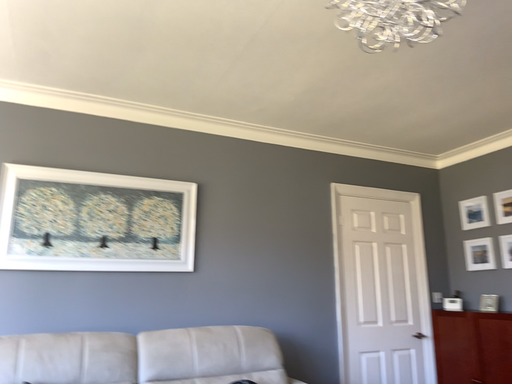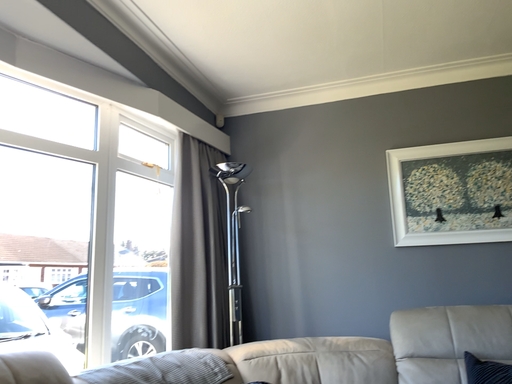
Question: Which way did the camera rotate in the video?

Choices:
 (A) rotated left
 (B) rotated right

Answer: (A)